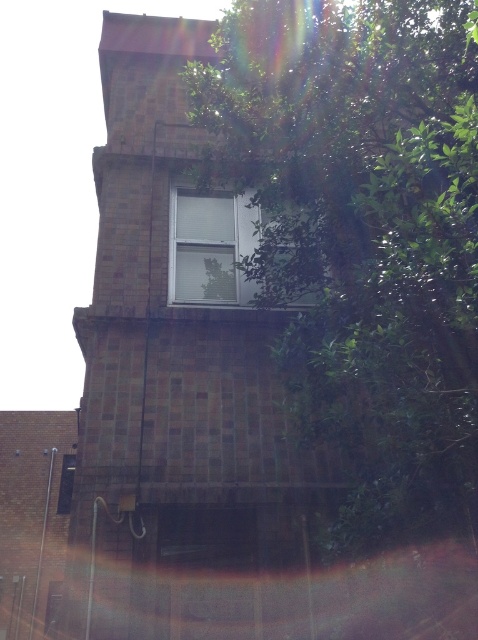
Question: Which point is farther to the camera?

Choices:
 (A) green leafy tree at upper right
 (B) white matte window at center

Answer: (B)

Question: Does green leafy tree at upper right have a larger size compared to white matte window at center?

Choices:
 (A) yes
 (B) no

Answer: (A)

Question: Can you confirm if green leafy tree at upper right is positioned above white matte window at center?

Choices:
 (A) yes
 (B) no

Answer: (B)

Question: Does green leafy tree at upper right appear on the right side of white matte window at center?

Choices:
 (A) yes
 (B) no

Answer: (A)

Question: Among these objects, which one is farthest from the camera?

Choices:
 (A) white matte window at center
 (B) green leafy tree at upper right

Answer: (A)